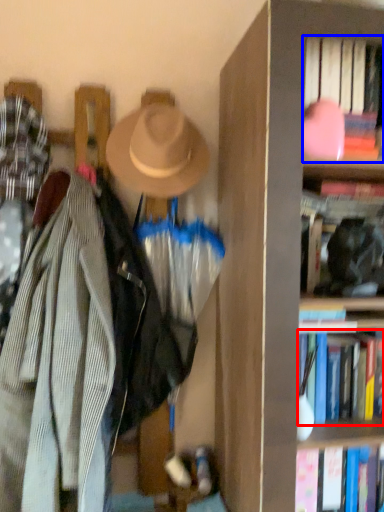
Question: Which object appears closest to the camera in this image, book (highlighted by a red box) or book (highlighted by a blue box)?

Choices:
 (A) book
 (B) book

Answer: (B)